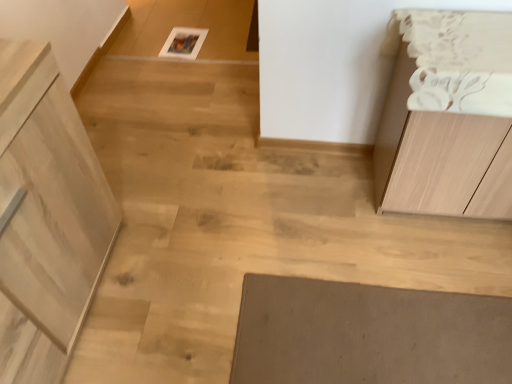
You are a GUI agent. You are given a task and a screenshot of the screen. Output one action in this format:
    pyautogui.click(x=<x>, y=<y>)
    Task: Click on the vacant space to the right of light wood cabinet at left, which is the 1th cabinetry from left to right
    
    Given the screenshot: What is the action you would take?
    pyautogui.click(x=184, y=281)